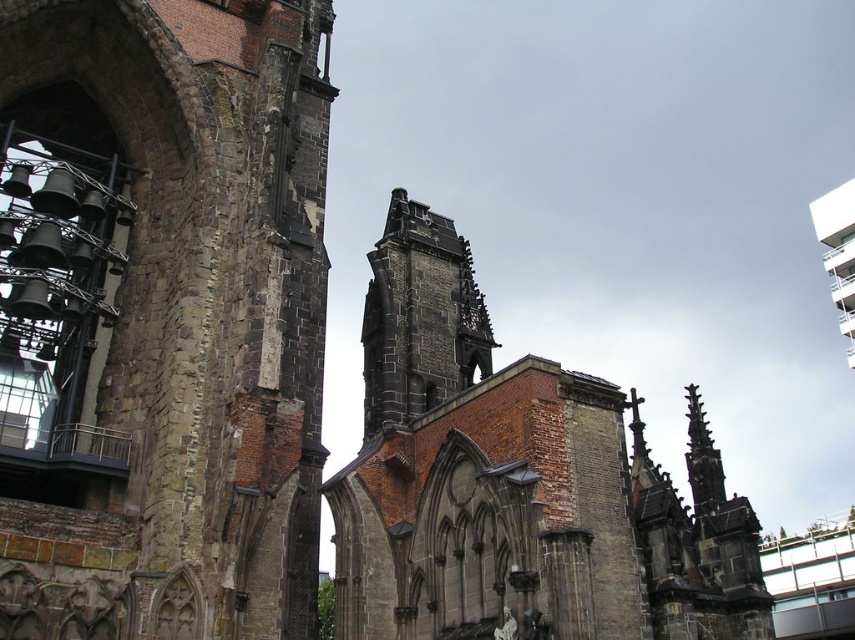
You are standing in front of the historic stone structure and want to take a photo that includes both the rusty stone tower at left and the dark gray stone tower at center. Which tower should you position closer to the left side of your camera frame to ensure both are visible?

You should position the rusty stone tower at left closer to the left side of your camera frame because it is already to the left of the dark gray stone tower at center, ensuring both are visible in the shot.

You are standing in front of the historic stone structure and want to locate the rusty stone tower at left. Based on the coordinates provided, where should you look relative to your position?

The rusty stone tower at left is located at coordinates point (161, 316), which means it is positioned slightly to the left and lower portion of your field of view.